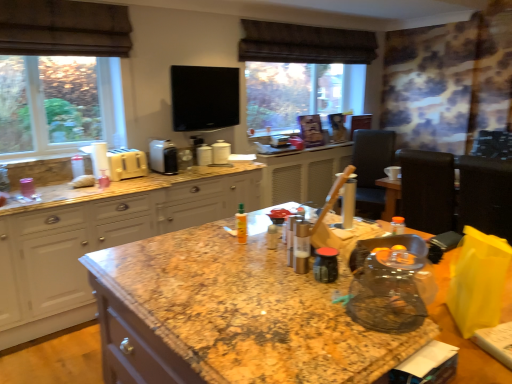
The height and width of the screenshot is (384, 512). In order to click on vacant space in front of yellow plastic toaster at left, the first appliance viewed from the left in this screenshot , I will do `click(129, 183)`.